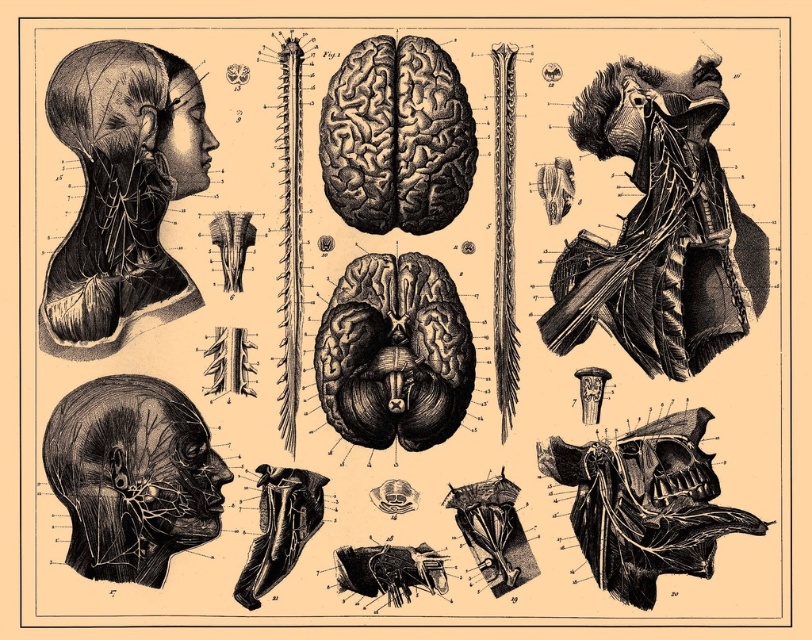
Question: Considering the relative positions of black engraving brain at center and matte black head at upper left in the image provided, where is black engraving brain at center located with respect to matte black head at upper left?

Choices:
 (A) below
 (B) above

Answer: (A)

Question: Is black engraving brain at center thinner than matte black head at upper left?

Choices:
 (A) no
 (B) yes

Answer: (B)

Question: Which of the following is the closest to the observer?

Choices:
 (A) (106, 225)
 (B) (89, 88)

Answer: (B)

Question: Which of the following is the closest to the observer?

Choices:
 (A) smooth black muscle at upper right
 (B) matte black head at upper left

Answer: (A)

Question: Which of the following is the closest to the observer?

Choices:
 (A) smooth black muscle at upper right
 (B) black line drawing of head at lower left
 (C) matte black head at upper left
 (D) black textured neck at lower left

Answer: (B)

Question: In this image, where is matte black head at upper left located relative to smooth black muscle at upper right?

Choices:
 (A) below
 (B) above

Answer: (A)